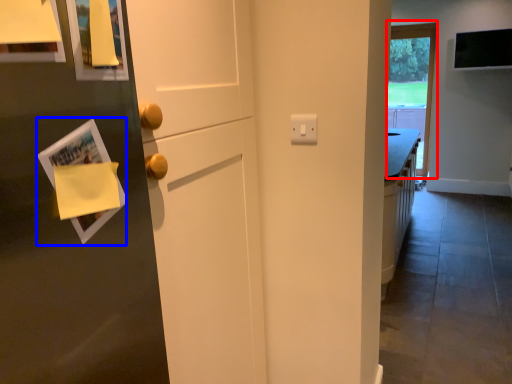
Question: Which object is closer to the camera taking this photo, window (highlighted by a red box) or magazine (highlighted by a blue box)?

Choices:
 (A) window
 (B) magazine

Answer: (B)